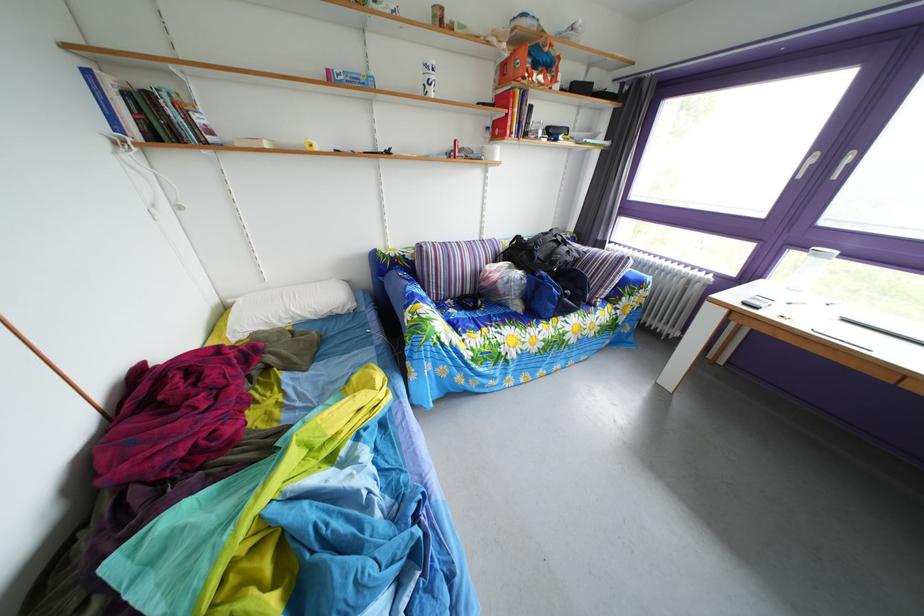
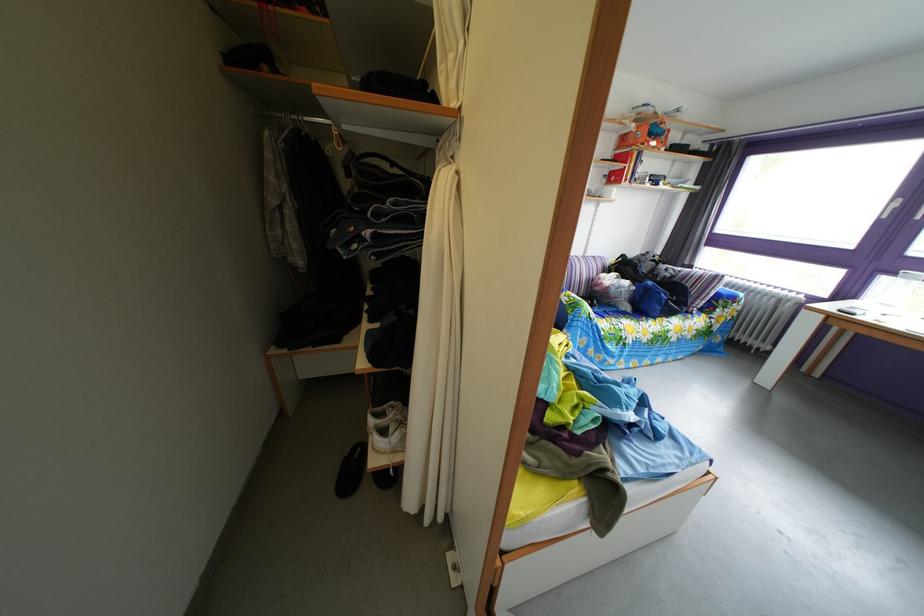
The point at (545, 74) is marked in the first image. Where is the corresponding point in the second image?

(661, 144)